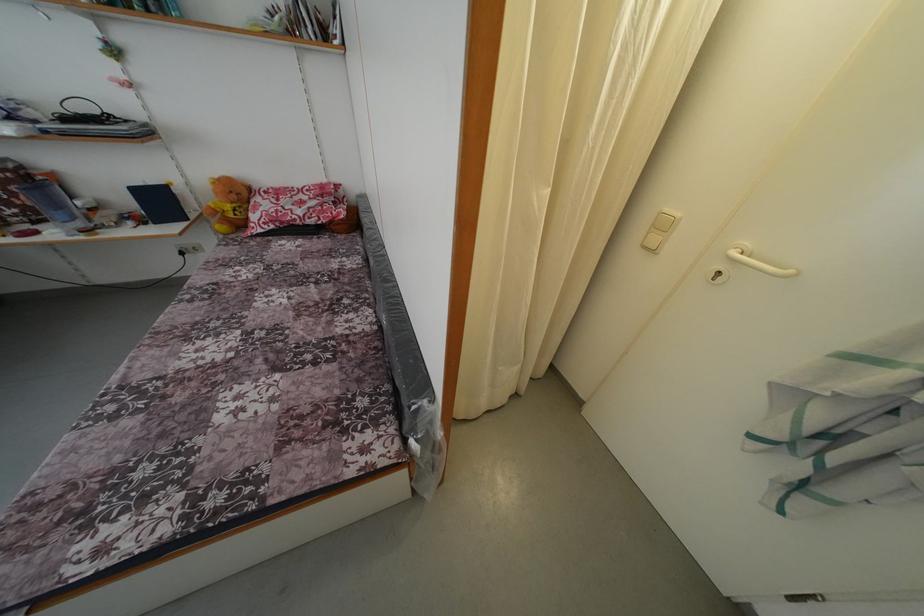
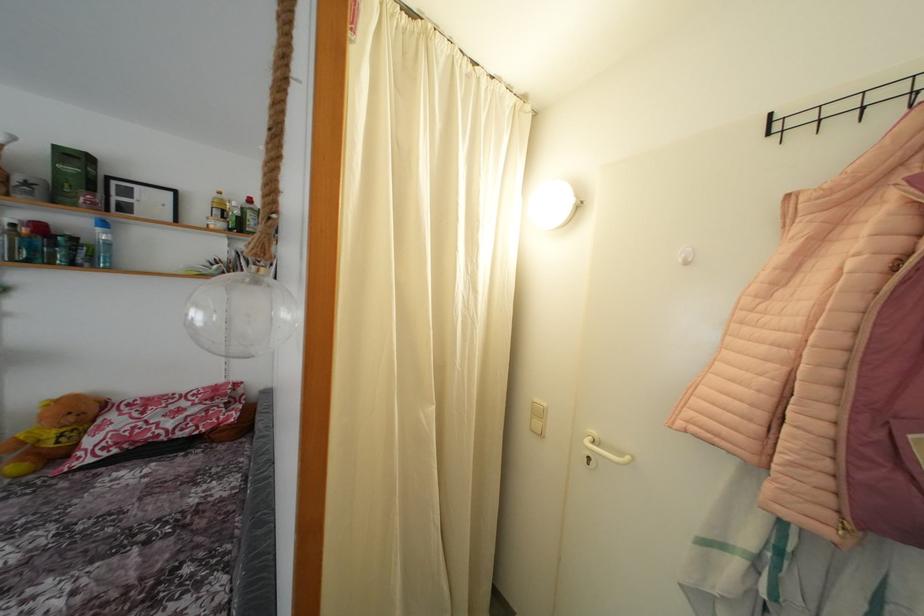
Where in the second image is the point corresponding to the point at 239,203 from the first image?

(77, 424)